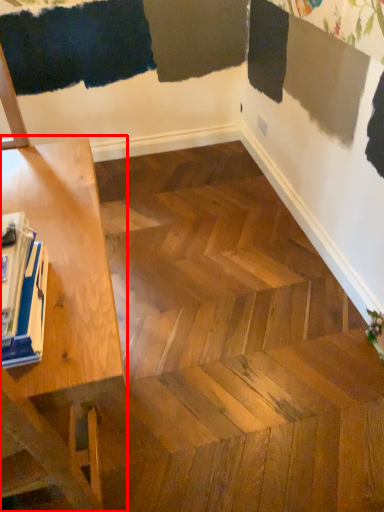
Question: In this image, where is table (annotated by the red box) located relative to magazine?

Choices:
 (A) left
 (B) right

Answer: (A)